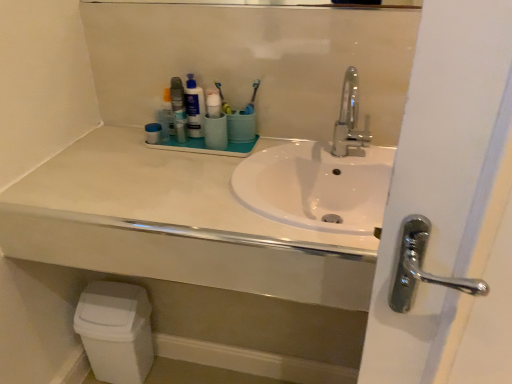
Locate an element on the screen. This screenshot has height=384, width=512. vacant space to the right of matte plastic container at upper center, which is the 1th toiletry in left-to-right order is located at coordinates (199, 147).